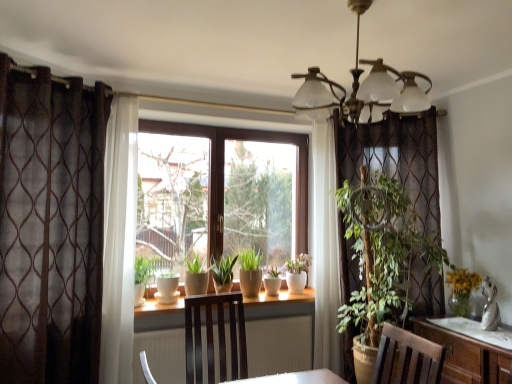
Question: Considering the relative positions of white ceramic flowerpot at center, the 1th flowerpot in the right-to-left sequence, and white ceramic pot at center in the image provided, is white ceramic flowerpot at center, the 1th flowerpot in the right-to-left sequence, behind white ceramic pot at center?

Choices:
 (A) yes
 (B) no

Answer: (B)

Question: Is white ceramic flowerpot at center, which ranks as the 2th flowerpot in left-to-right order, not within white ceramic pot at center?

Choices:
 (A) yes
 (B) no

Answer: (A)

Question: Is white ceramic flowerpot at center, the 1th flowerpot in the right-to-left sequence, surrounding white ceramic pot at center?

Choices:
 (A) no
 (B) yes

Answer: (A)

Question: Does white ceramic flowerpot at center, the 1th flowerpot in the right-to-left sequence, have a greater height compared to white ceramic pot at center?

Choices:
 (A) no
 (B) yes

Answer: (A)

Question: From a real-world perspective, does white ceramic flowerpot at center, which ranks as the 2th flowerpot in left-to-right order, sit lower than white ceramic pot at center?

Choices:
 (A) no
 (B) yes

Answer: (A)

Question: Considering the relative sizes of white ceramic flowerpot at center, which ranks as the 2th flowerpot in left-to-right order, and white ceramic pot at center in the image provided, is white ceramic flowerpot at center, which ranks as the 2th flowerpot in left-to-right order, wider than white ceramic pot at center?

Choices:
 (A) no
 (B) yes

Answer: (A)

Question: From a real-world perspective, is white ceramic pot at center located higher than matte ceramic pot at center, which is counted as the first flowerpot, starting from the left?

Choices:
 (A) yes
 (B) no

Answer: (A)

Question: Does white ceramic pot at center come in front of matte ceramic pot at center, which is counted as the first flowerpot, starting from the left?

Choices:
 (A) no
 (B) yes

Answer: (A)

Question: Is white ceramic pot at center facing away from matte ceramic pot at center, positioned as the second flowerpot in right-to-left order?

Choices:
 (A) yes
 (B) no

Answer: (B)

Question: Considering the relative sizes of white ceramic pot at center and matte ceramic pot at center, which is counted as the first flowerpot, starting from the left, in the image provided, is white ceramic pot at center taller than matte ceramic pot at center, which is counted as the first flowerpot, starting from the left,?

Choices:
 (A) no
 (B) yes

Answer: (B)

Question: Can matte ceramic pot at center, positioned as the second flowerpot in right-to-left order, be found inside white ceramic pot at center?

Choices:
 (A) yes
 (B) no

Answer: (B)

Question: Does white ceramic pot at center have a smaller size compared to matte ceramic pot at center, positioned as the second flowerpot in right-to-left order?

Choices:
 (A) yes
 (B) no

Answer: (B)

Question: Is white ceramic flowerpot at center, which ranks as the 2th flowerpot in left-to-right order, not near brown sheer curtain at left?

Choices:
 (A) yes
 (B) no

Answer: (A)